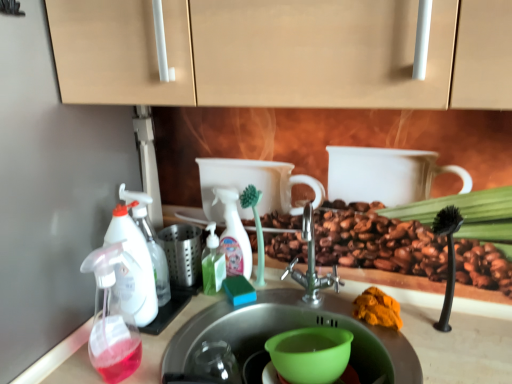
At what (x,y) coordinates should I click in order to perform the action: click on vacant area that lies between translucent plastic spray bottle at left, which appears as the 2th soap dispenser when viewed from the left, and translucent plastic spray bottle at center. Please return your answer as a coordinate pair (x, y). Looking at the image, I should click on (185, 322).